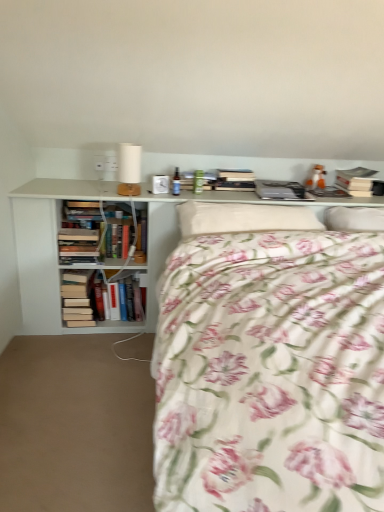
Question: Does floral cotton bed at center come behind white soft pillow at upper right, the second pillow positioned from the left?

Choices:
 (A) no
 (B) yes

Answer: (A)

Question: Is floral cotton bed at center facing away from white soft pillow at upper right, the second pillow positioned from the left?

Choices:
 (A) no
 (B) yes

Answer: (A)

Question: Considering the relative sizes of floral cotton bed at center and white soft pillow at upper right, which is counted as the 1th pillow, starting from the right, in the image provided, is floral cotton bed at center bigger than white soft pillow at upper right, which is counted as the 1th pillow, starting from the right,?

Choices:
 (A) no
 (B) yes

Answer: (B)

Question: Is floral cotton bed at center oriented towards white soft pillow at upper right, which is counted as the 1th pillow, starting from the right?

Choices:
 (A) no
 (B) yes

Answer: (A)

Question: From the image's perspective, does floral cotton bed at center appear higher than white soft pillow at upper right, which is counted as the 1th pillow, starting from the right?

Choices:
 (A) yes
 (B) no

Answer: (B)

Question: Does floral cotton bed at center have a lesser width compared to white soft pillow at upper right, the second pillow positioned from the left?

Choices:
 (A) yes
 (B) no

Answer: (B)

Question: Does fluffy white pillow at center, which is the 1th pillow in left-to-right order, lie in front of hardcover books at left, placed as the third book when sorted from top to bottom?

Choices:
 (A) yes
 (B) no

Answer: (A)

Question: Can you confirm if fluffy white pillow at center, placed as the 2th pillow when sorted from right to left, is wider than hardcover books at left, which is the first book in left-to-right order?

Choices:
 (A) yes
 (B) no

Answer: (A)

Question: From the image's perspective, does fluffy white pillow at center, which is the 1th pillow in left-to-right order, appear lower than hardcover books at left, positioned as the 3th book in right-to-left order?

Choices:
 (A) no
 (B) yes

Answer: (A)

Question: Does fluffy white pillow at center, which is the 1th pillow in left-to-right order, have a greater height compared to hardcover books at left, which is the first book in left-to-right order?

Choices:
 (A) yes
 (B) no

Answer: (B)

Question: Is fluffy white pillow at center, which is the 1th pillow in left-to-right order, thinner than hardcover books at left, which is the first book in left-to-right order?

Choices:
 (A) yes
 (B) no

Answer: (B)

Question: Is fluffy white pillow at center, which is the 1th pillow in left-to-right order, oriented away from hardcover books at left, the 1th book in the bottom-to-top sequence?

Choices:
 (A) no
 (B) yes

Answer: (A)

Question: Is fluffy white pillow at center, placed as the 2th pillow when sorted from right to left, taller than white matte table lamp at upper center?

Choices:
 (A) no
 (B) yes

Answer: (A)